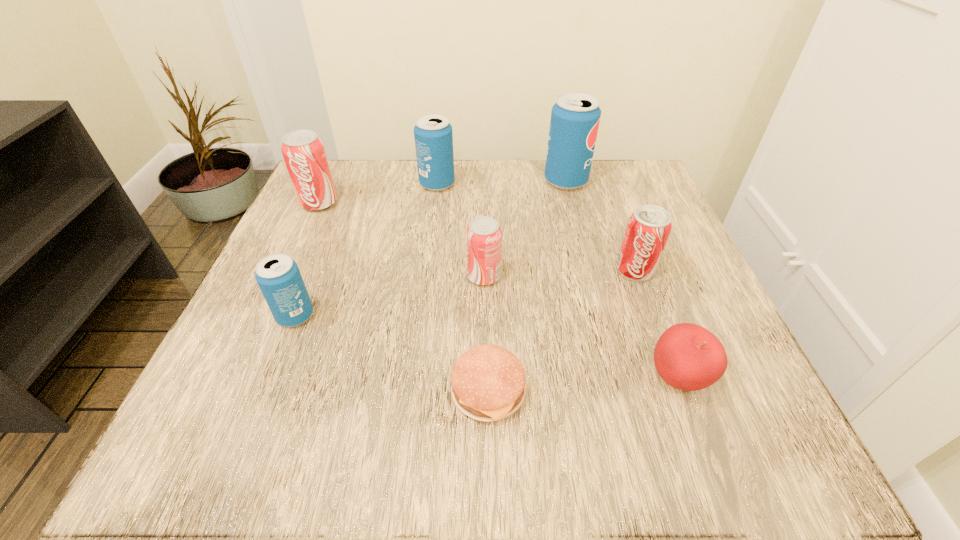
Locate an element on the screen. The height and width of the screenshot is (540, 960). the biggest blue soda can is located at coordinates (575, 117).

Find the location of a particular element. This screenshot has height=540, width=960. the tallest soda can is located at coordinates (575, 117).

Image resolution: width=960 pixels, height=540 pixels. Identify the location of the fourth soda can from right to left. [433, 135].

The width and height of the screenshot is (960, 540). Identify the location of the third object from left to right. (433, 135).

The image size is (960, 540). Find the location of `the farthest red soda can`. the farthest red soda can is located at coordinates (303, 151).

This screenshot has height=540, width=960. Find the location of `the leftmost red soda can`. the leftmost red soda can is located at coordinates (303, 151).

Locate an element on the screen. The width and height of the screenshot is (960, 540). the rightmost red soda can is located at coordinates (648, 228).

The image size is (960, 540). What are the coordinates of `the fourth soda can from left to right` in the screenshot? It's located at (483, 235).

Locate an element on the screen. the leftmost blue soda can is located at coordinates tap(279, 279).

Identify the location of the third nearest object. This screenshot has width=960, height=540. (279, 279).